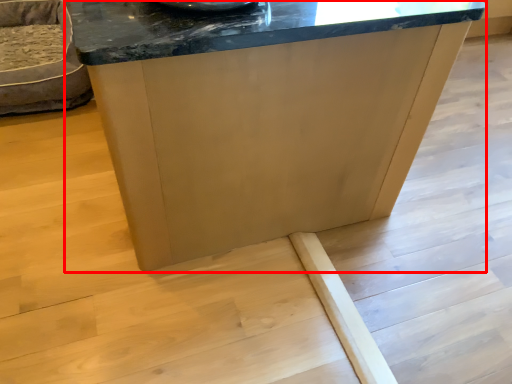
Question: Observing the image, what is the correct spatial positioning of table (annotated by the red box) in reference to furniture?

Choices:
 (A) left
 (B) right

Answer: (B)